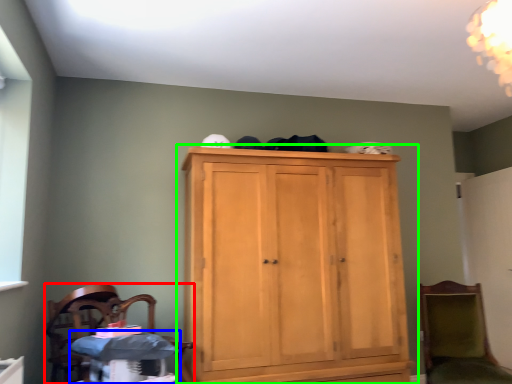
Question: Estimate the real-world distances between objects in this image. Which object is farther from chair (highlighted by a red box), changing table (highlighted by a blue box) or cupboard (highlighted by a green box)?

Choices:
 (A) changing table
 (B) cupboard

Answer: (B)